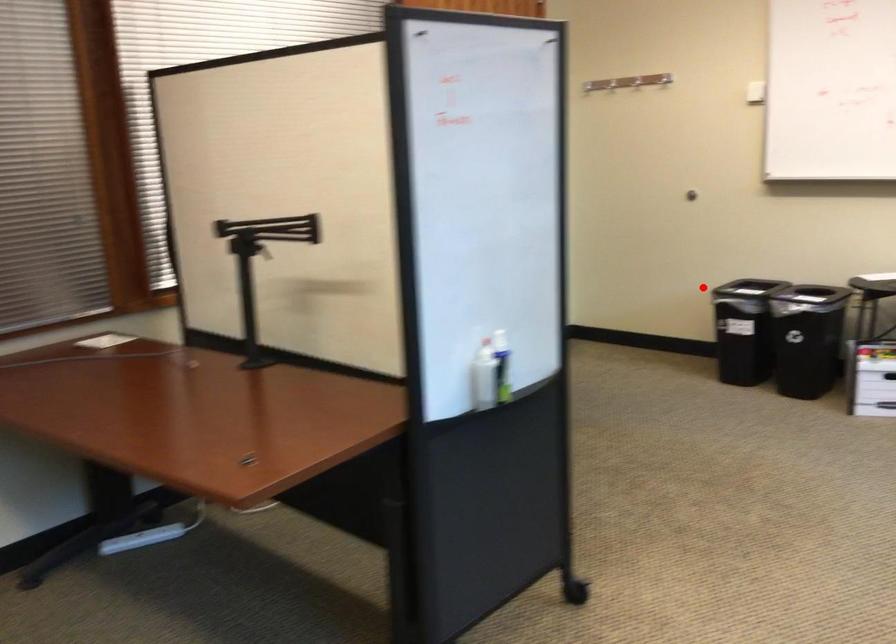
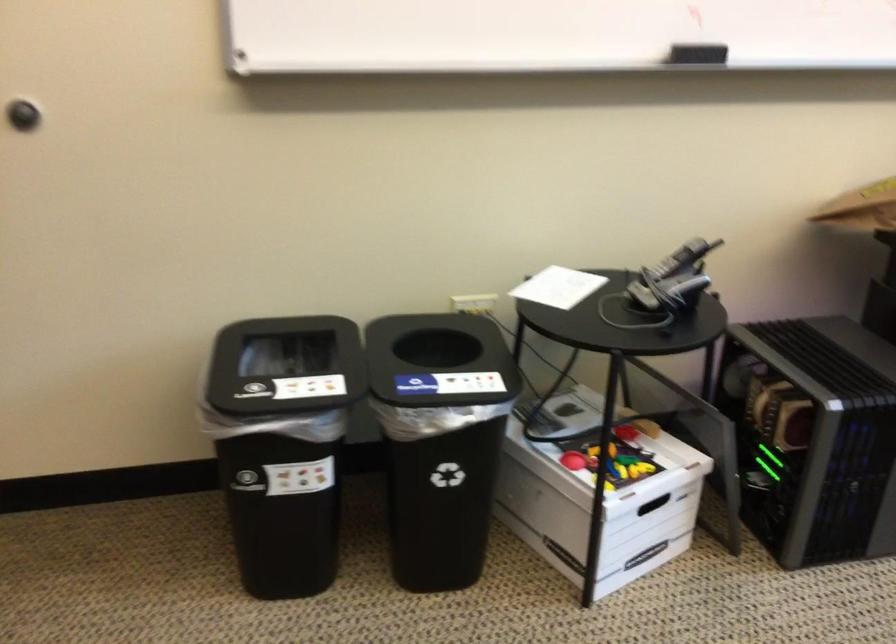
Question: I am providing you with two images of the same scene from different viewpoints. Image1 has a red point marked. In image2, the corresponding 3D location appears at what relative position? Reply with the corresponding letter.

Choices:
 (A) Closer
 (B) Farther

Answer: (A)